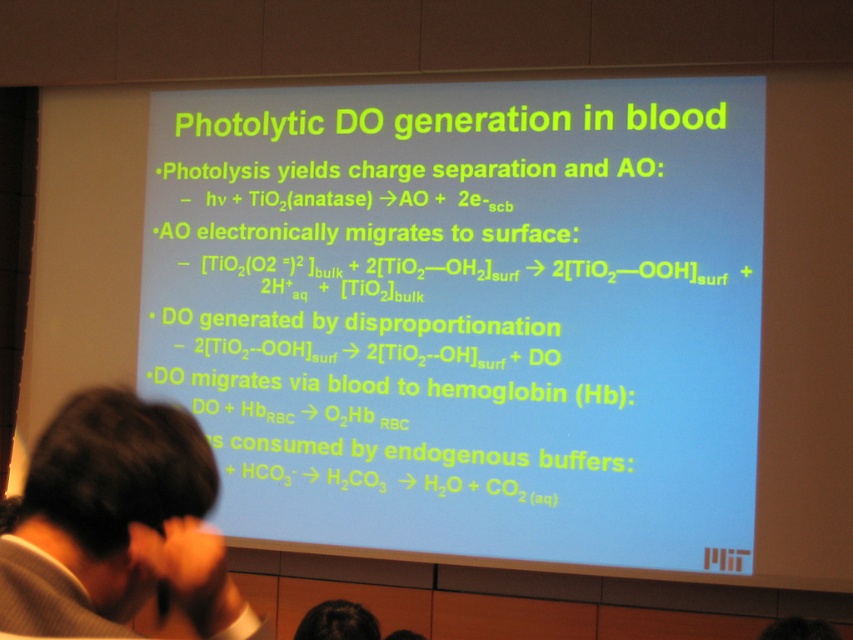
Question: Which point is farther from the camera taking this photo?

Choices:
 (A) (206, 509)
 (B) (384, 394)

Answer: (B)

Question: In this image, where is white text on blue background at center located relative to dark hair at lower left?

Choices:
 (A) above
 (B) below

Answer: (A)

Question: Which point is closer to the camera?

Choices:
 (A) white text on blue background at center
 (B) dark hair at lower left

Answer: (B)

Question: Does white text on blue background at center appear under dark hair at lower left?

Choices:
 (A) no
 (B) yes

Answer: (A)

Question: Which point is closer to the camera?

Choices:
 (A) dark hair at lower left
 (B) white text on blue background at center

Answer: (A)

Question: Does white text on blue background at center appear on the right side of dark hair at lower left?

Choices:
 (A) no
 (B) yes

Answer: (B)